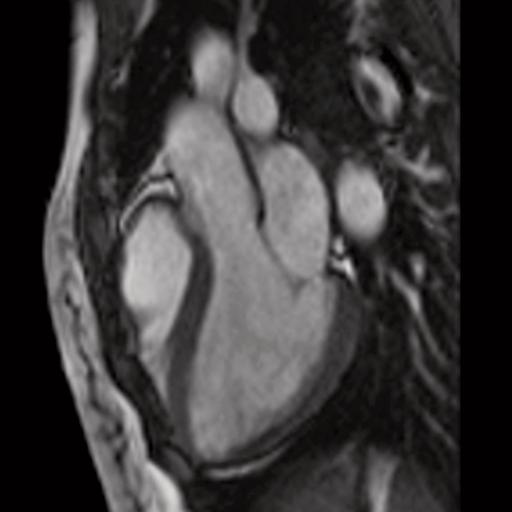
This screenshot has width=512, height=512. What are the coordinates of `darkened shade` in the screenshot? It's located at (144, 84), (356, 406), (259, 485).